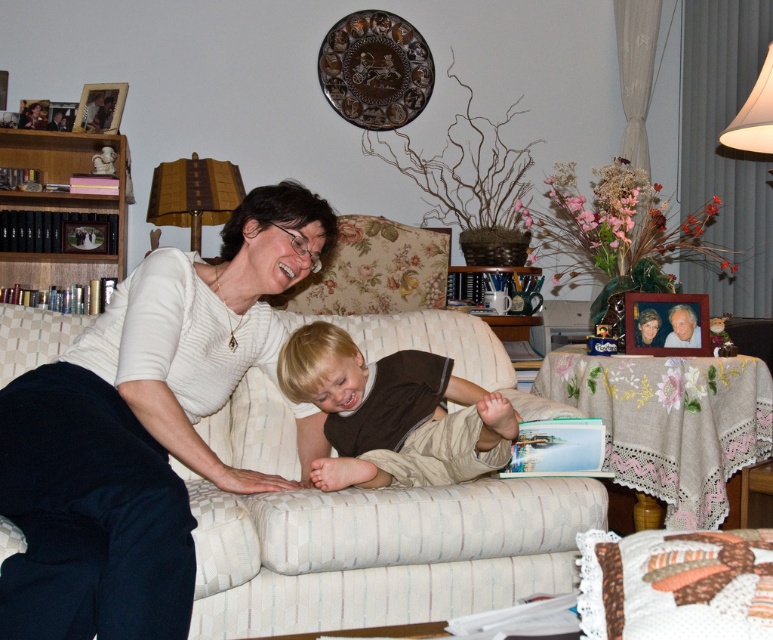
Question: Which is nearer to the blonde hair boy at center?

Choices:
 (A) wooden books at left
 (B) white matte sweater at center
 (C) white striped couch at center

Answer: (C)

Question: Estimate the real-world distances between objects in this image. Which object is closer to the white matte sweater at center?

Choices:
 (A) blonde hair boy at center
 (B) wooden books at left
 (C) white striped couch at center

Answer: (A)

Question: Is blonde hair boy at center to the right of wooden books at left from the viewer's perspective?

Choices:
 (A) yes
 (B) no

Answer: (A)

Question: Is white matte sweater at center above blonde hair boy at center?

Choices:
 (A) no
 (B) yes

Answer: (B)

Question: Among these objects, which one is nearest to the camera?

Choices:
 (A) wooden books at left
 (B) blonde hair boy at center
 (C) white striped couch at center
 (D) white matte sweater at center

Answer: (D)

Question: Does blonde hair boy at center appear over wooden books at left?

Choices:
 (A) yes
 (B) no

Answer: (B)